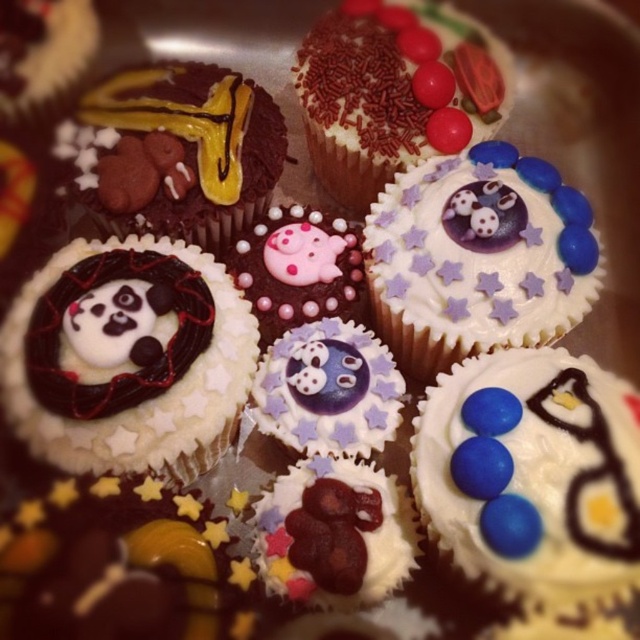
Question: Which point is farther to the camera?

Choices:
 (A) chocolate matte pig at center
 (B) matte white cupcake with blue candies at center

Answer: (A)

Question: Which of the following is the farthest from the observer?

Choices:
 (A) (390, 100)
 (B) (240, 216)

Answer: (A)

Question: Can you confirm if white fondant cupcake with panda decoration at center is positioned to the left of chocolate matte pig at center?

Choices:
 (A) no
 (B) yes

Answer: (B)

Question: Which object appears closest to the camera in this image?

Choices:
 (A) chocolate matte pig at center
 (B) white fondant cupcake with panda decoration at center
 (C) purple glossy cupcake at center
 (D) matte white cupcake with blue candies at center

Answer: (D)

Question: Considering the relative positions of sprinkled chocolate cupcake at center and chocolatesmoothcupcake at center in the image provided, where is sprinkled chocolate cupcake at center located with respect to chocolatesmoothcupcake at center?

Choices:
 (A) left
 (B) right

Answer: (B)

Question: Is white fondant cupcake with star decorations at upper center closer to the viewer compared to sprinkled chocolate cupcake at center?

Choices:
 (A) yes
 (B) no

Answer: (A)